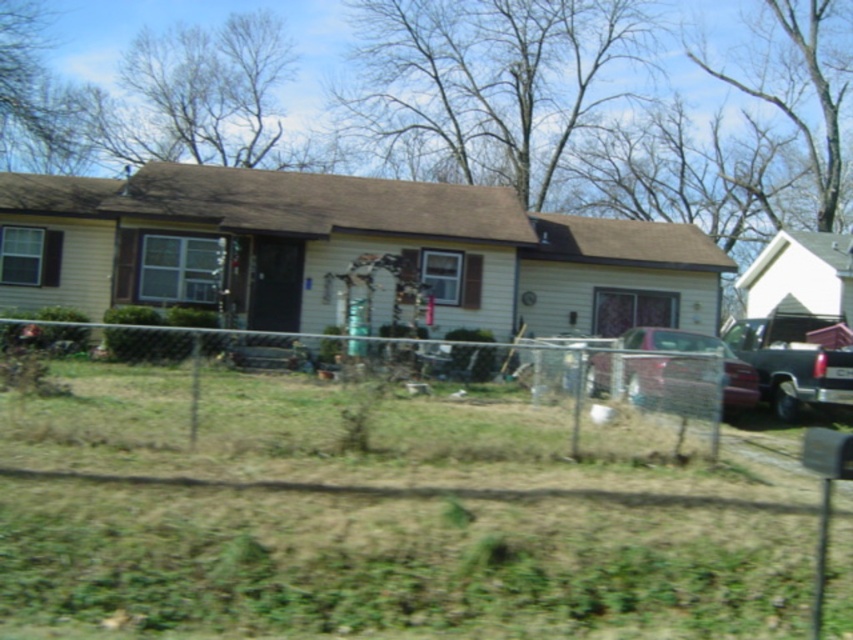
Is wire mesh fence at center to the right of metallic maroon sedan at center from the viewer's perspective?

Incorrect, wire mesh fence at center is not on the right side of metallic maroon sedan at center.

Does wire mesh fence at center appear on the left side of metallic maroon sedan at center?

Indeed, wire mesh fence at center is positioned on the left side of metallic maroon sedan at center.

Identify the location of wire mesh fence at center. (373, 388).

Which is behind, point (254, 532) or point (399, 346)?

The point (399, 346) is more distant.

Is point (633, 518) in front of point (33, 372)?

That is True.

Identify the location of green grass at lower center. This screenshot has height=640, width=853. (387, 492).

At what (x,y) coordinates should I click in order to perform the action: click on green grass at lower center. Please return your answer as a coordinate pair (x, y). Looking at the image, I should click on (387, 492).

Consider the image. Can you confirm if metallic maroon sedan at center is bigger than metallic dark gray truck at right?

Indeed, metallic maroon sedan at center has a larger size compared to metallic dark gray truck at right.

Is metallic maroon sedan at center smaller than metallic dark gray truck at right?

Actually, metallic maroon sedan at center might be larger than metallic dark gray truck at right.

Is point (729, 353) positioned in front of point (728, 333)?

That is True.

The height and width of the screenshot is (640, 853). I want to click on metallic maroon sedan at center, so click(669, 381).